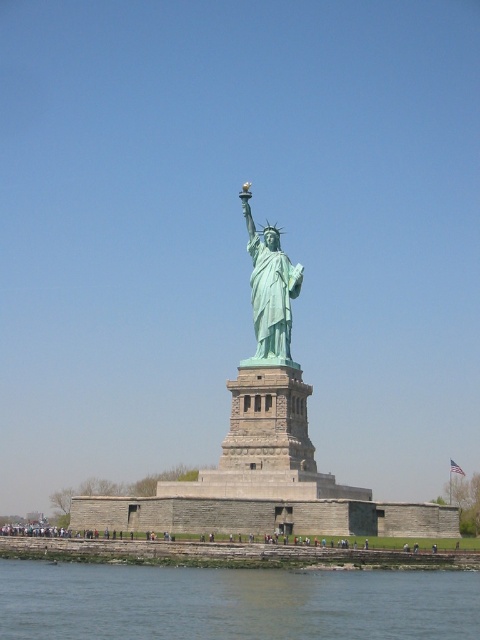
You are a photographer planning to capture the Statue of Liberty from a boat. You notice the greenish water at lower center and the green patina statue at center. Which object appears taller in the photograph?

The green patina statue at center appears taller than the greenish water at lower center in the photograph.

You are a tourist standing on the dock near the Statue of Liberty. You see the greenish water at lower center and the green patina statue at center. Which one appears wider from your viewpoint?

The greenish water at lower center might be wider than the green patina statue at center.

You are a photographer planning to capture the Statue of Liberty with a drone. Your drone has a camera that can focus on objects within a 100 meter radius. Given the scene, can the drone capture both the greenish water at lower center and the green patina statue at center in a single shot without zooming out?

The greenish water at lower center has a larger size compared to the green patina statue at center, so the drone can capture both in a single shot as the water occupies more space in the frame, allowing the statue to be included without needing to zoom out.